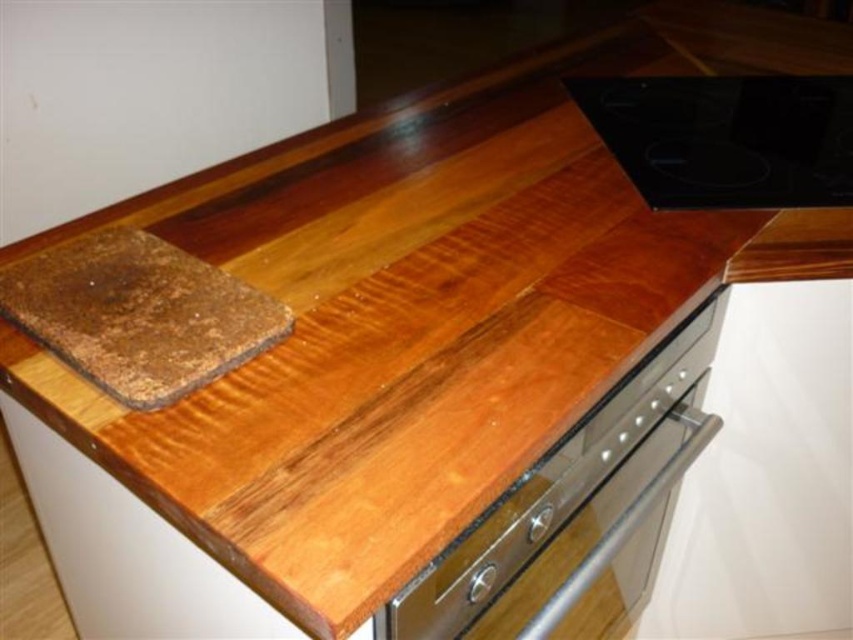
Is satin silver oven at lower center smaller than black glass cooktop at upper right?

Incorrect, satin silver oven at lower center is not smaller in size than black glass cooktop at upper right.

Is satin silver oven at lower center taller than black glass cooktop at upper right?

Correct, satin silver oven at lower center is much taller as black glass cooktop at upper right.

Where is `satin silver oven at lower center`? This screenshot has height=640, width=853. satin silver oven at lower center is located at coordinates tap(576, 515).